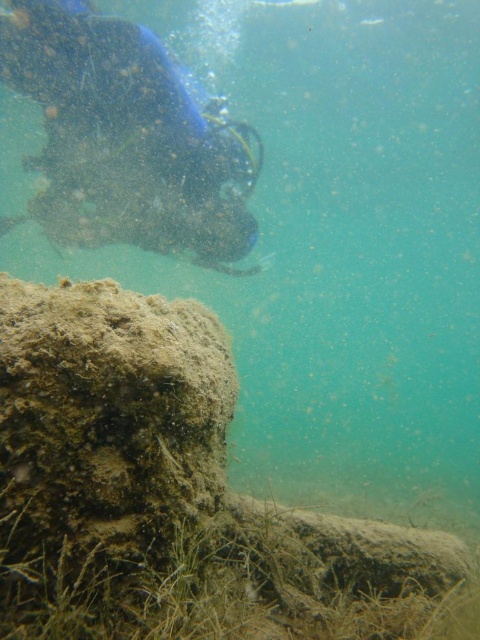
Is brown mossy rock at lower left further to the viewer compared to blue rubber mask at upper left?

No, it is in front of blue rubber mask at upper left.

The height and width of the screenshot is (640, 480). What do you see at coordinates (106, 435) in the screenshot?
I see `brown mossy rock at lower left` at bounding box center [106, 435].

You are a GUI agent. You are given a task and a screenshot of the screen. Output one action in this format:
    pyautogui.click(x=<x>, y=<y>)
    Task: Click on the brown mossy rock at lower left
    
    Given the screenshot: What is the action you would take?
    pyautogui.click(x=106, y=435)